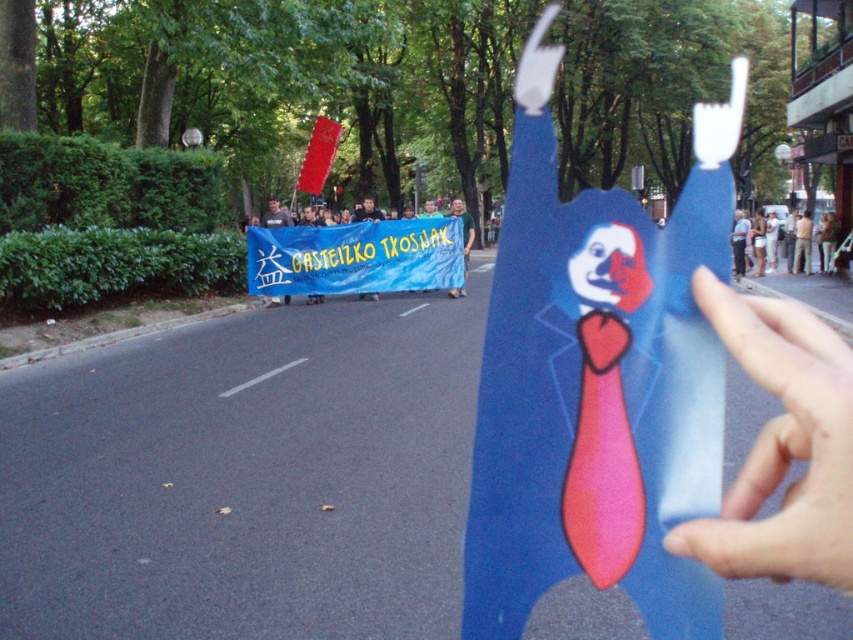
Which is below, pink fabric tie at center or blue paper cutout at center?

pink fabric tie at center is below.

Who is positioned more to the left, pink fabric tie at center or blue paper cutout at center?

Positioned to the left is pink fabric tie at center.

Who is more distant from viewer, (x=587, y=564) or (x=469, y=230)?

The point (x=469, y=230) is more distant.

Where is `pink fabric tie at center`? The width and height of the screenshot is (853, 640). pink fabric tie at center is located at coordinates [602, 460].

Who is higher up, smooth blue paper at center or light blue paper cutout at right?

light blue paper cutout at right

Between point (827, 508) and point (770, 218), which one is positioned behind?

Positioned behind is point (770, 218).

You are a GUI agent. You are given a task and a screenshot of the screen. Output one action in this format:
    pyautogui.click(x=<x>, y=<y>)
    Task: Click on the smooth blue paper at center
    
    Given the screenshot: What is the action you would take?
    pyautogui.click(x=782, y=445)

Consider the image. Between smooth blue paper at center and blue fabric banner at center, which one has more height?

With more height is blue fabric banner at center.

Is point (711, 561) farther from viewer compared to point (334, 240)?

No.

Identify the location of smooth blue paper at center. (782, 445).